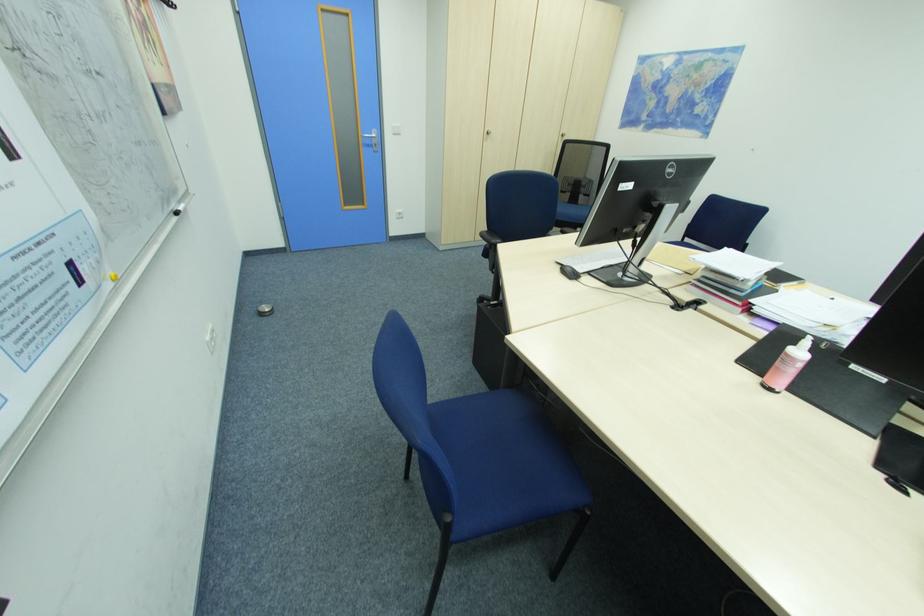
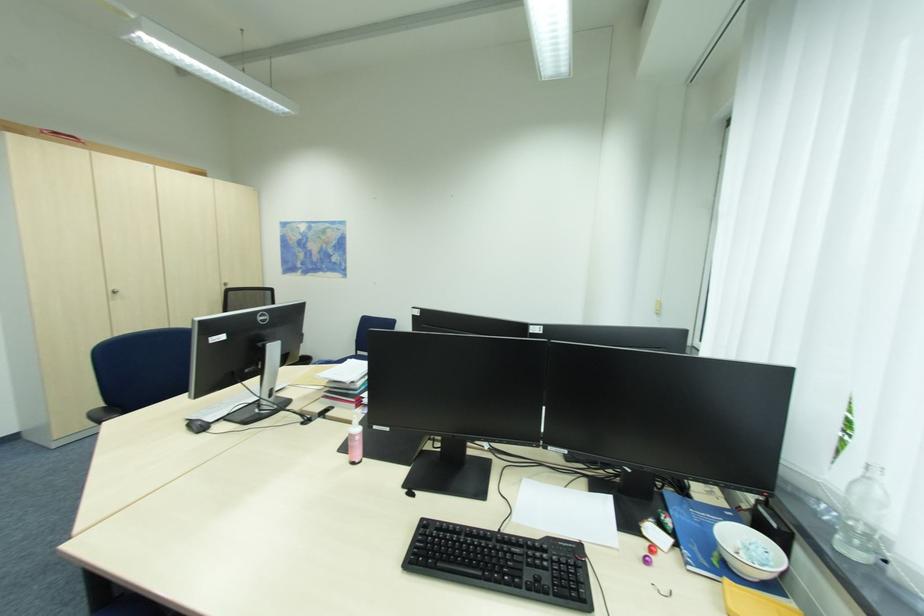
Question: The camera is either moving clockwise (left) or counter-clockwise (right) around the object. The first image is from the beginning of the video and the second image is from the end. Is the camera moving left or right when shooting the video?

Choices:
 (A) Left
 (B) Right

Answer: (A)